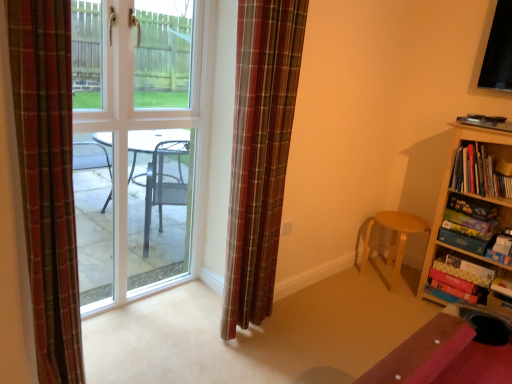
Question: Is plaid fabric curtain at left, the 1th curtain viewed from the front, far away from wooden bookshelf at right?

Choices:
 (A) yes
 (B) no

Answer: (A)

Question: Can you confirm if plaid fabric curtain at left, the 1th curtain viewed from the front, is smaller than wooden bookshelf at right?

Choices:
 (A) yes
 (B) no

Answer: (A)

Question: Is plaid fabric curtain at left, the 1th curtain viewed from the front, facing towards wooden bookshelf at right?

Choices:
 (A) yes
 (B) no

Answer: (B)

Question: Is plaid fabric curtain at left, the 1th curtain viewed from the left, facing away from wooden bookshelf at right?

Choices:
 (A) yes
 (B) no

Answer: (B)

Question: Can you confirm if plaid fabric curtain at left, which ranks as the 2th curtain in back-to-front order, is taller than wooden bookshelf at right?

Choices:
 (A) yes
 (B) no

Answer: (A)

Question: Relative to clear glass door at center, is plaid fabric curtain at left, the 1th curtain viewed from the front, in front or behind?

Choices:
 (A) behind
 (B) front

Answer: (B)

Question: From a real-world perspective, is plaid fabric curtain at left, which ranks as the 2th curtain in back-to-front order, positioned above or below clear glass door at center?

Choices:
 (A) above
 (B) below

Answer: (B)

Question: Is plaid fabric curtain at left, which ranks as the 2th curtain in back-to-front order, wider or thinner than clear glass door at center?

Choices:
 (A) thin
 (B) wide

Answer: (B)

Question: From the image's perspective, relative to clear glass door at center, is plaid fabric curtain at left, the 1th curtain viewed from the left, above or below?

Choices:
 (A) above
 (B) below

Answer: (B)

Question: Considering the positions of wooden bookshelf at right and clear glass door at center in the image, is wooden bookshelf at right taller or shorter than clear glass door at center?

Choices:
 (A) short
 (B) tall

Answer: (A)

Question: Considering the relative positions of wooden bookshelf at right and clear glass door at center in the image provided, is wooden bookshelf at right to the left or to the right of clear glass door at center?

Choices:
 (A) right
 (B) left

Answer: (A)

Question: Relative to clear glass door at center, is wooden bookshelf at right in front or behind?

Choices:
 (A) behind
 (B) front

Answer: (A)

Question: Considering the positions of wooden bookshelf at right and clear glass door at center in the image, is wooden bookshelf at right wider or thinner than clear glass door at center?

Choices:
 (A) wide
 (B) thin

Answer: (A)

Question: Is point (20, 105) positioned closer to the camera than point (261, 304)?

Choices:
 (A) farther
 (B) closer

Answer: (B)

Question: Looking at the image, does plaid fabric curtain at left, which ranks as the 2th curtain in back-to-front order, seem bigger or smaller compared to plaid fabric curtain at center, which appears as the 2th curtain when viewed from the left?

Choices:
 (A) big
 (B) small

Answer: (B)